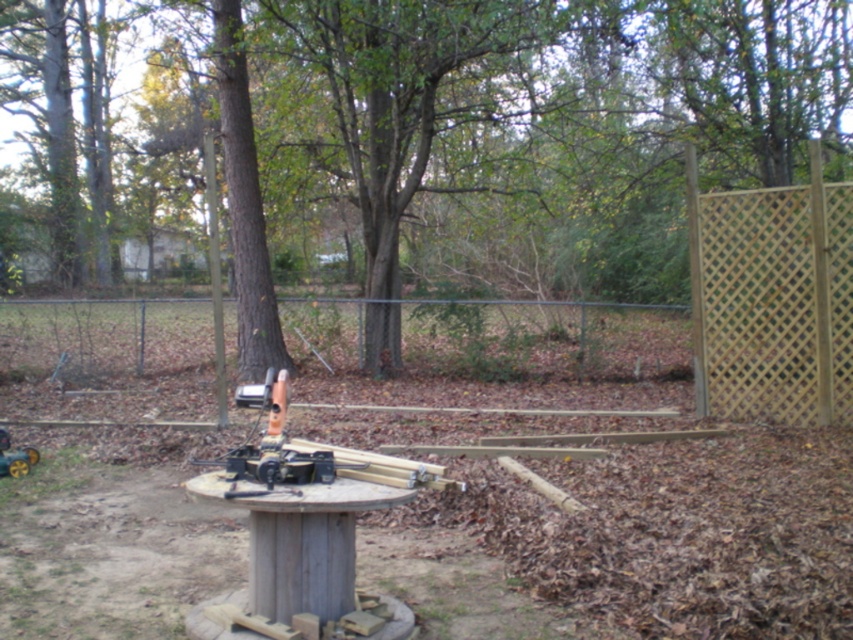
You are standing in a backyard during autumn. There is a brown wood tree at center. If you want to reach the tree, how many steps would you need to take if each step is about 3 feet?

The brown wood tree at center is 30.73 feet away from the viewer. Since each step is about 3 feet, you would need approximately 10 steps to reach the tree.

You are standing in the backyard and want to place a new garden bench exactly at the center of the backyard. The wooden lattice fence at center is located at coordinates 0.531 on the x and 0.639 on the y. Can you use the fence to determine if the center of the backyard is to the left or right of the fence?

The wooden lattice fence at center is located at coordinates 0.531 on the x and 0.639 on the y. Since the x coordinate is 0.531, which is slightly to the right of the exact center point at 0.5, the center of the backyard would be to the left of the fence.

You are planning to take a photo of the brown wood tree at center and the light brown lattice fence at right. Which object should you focus on first if you want to capture both in a single frame without moving the camera?

The brown wood tree at center is larger in size than the light brown lattice fence at right, so you should focus on the brown wood tree at center first to ensure it fits properly in the frame.